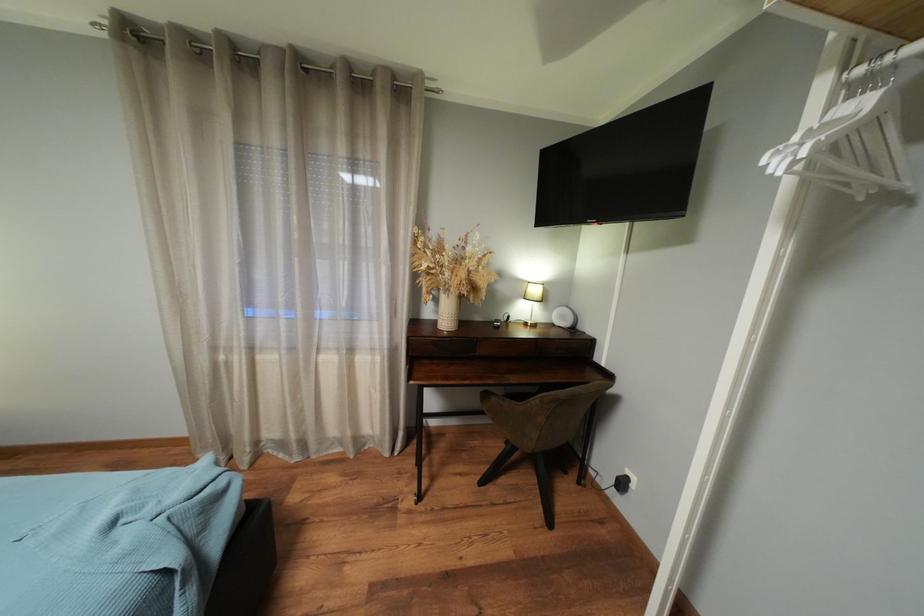
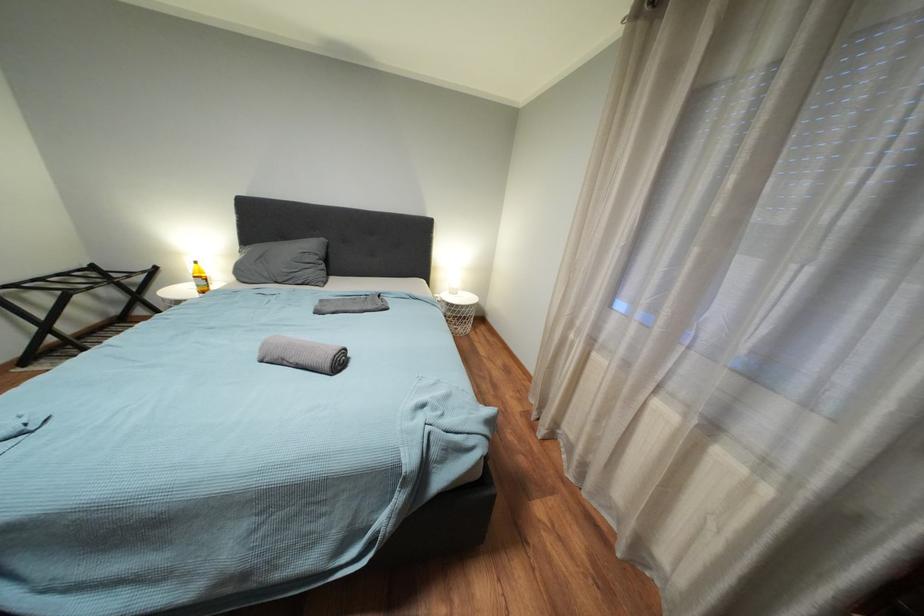
How did the camera likely rotate?

The rotation direction of the camera is left-down.